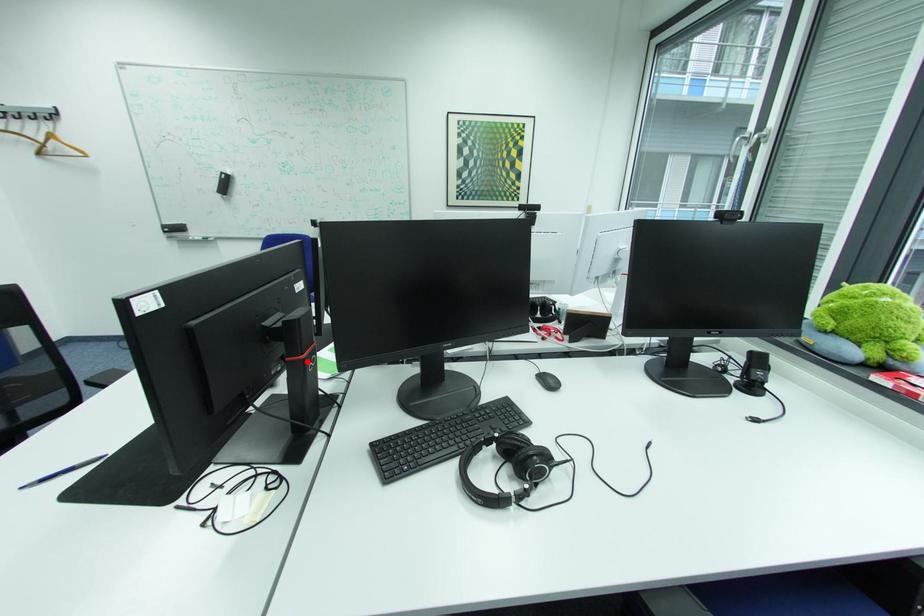
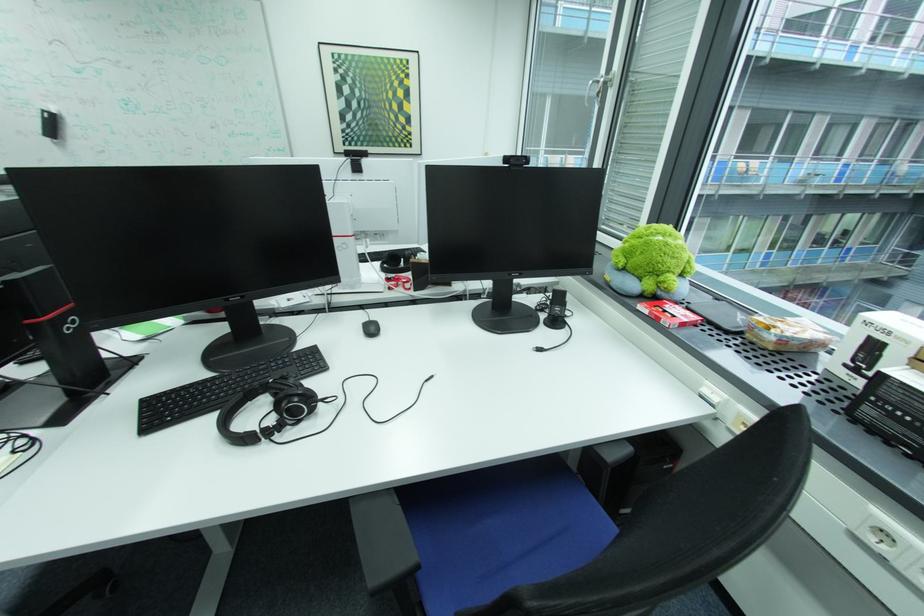
Where in the second image is the point corresponding to the highlighted location from the first image?

(47, 323)